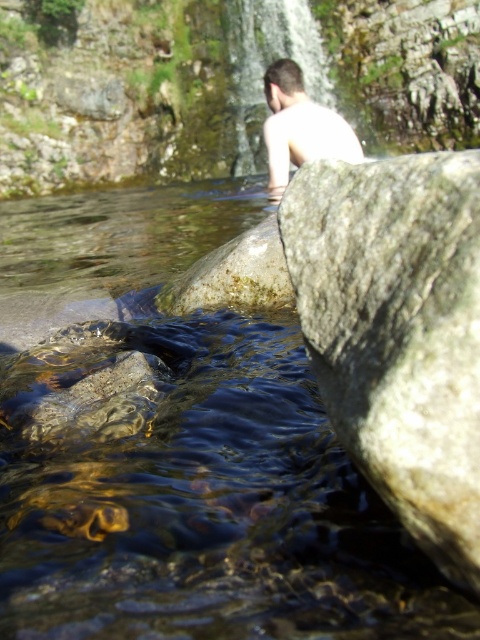
Question: Can you confirm if transparent water at center is wider than light skin human at center?

Choices:
 (A) no
 (B) yes

Answer: (B)

Question: Is transparent water at center behind light skin human at center?

Choices:
 (A) yes
 (B) no

Answer: (B)

Question: Is transparent water at center further to camera compared to light skin human at center?

Choices:
 (A) yes
 (B) no

Answer: (B)

Question: Among these objects, which one is nearest to the camera?

Choices:
 (A) transparent water at center
 (B) light skin human at center

Answer: (A)